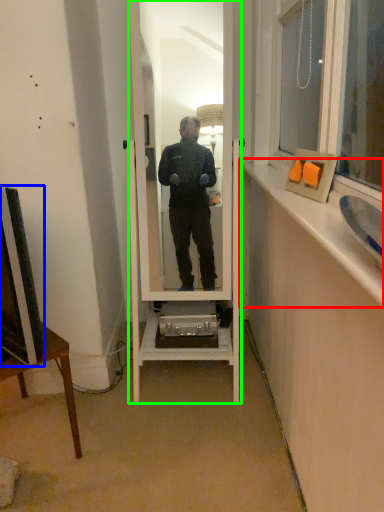
Question: Estimate the real-world distances between objects in this image. Which object is closer to window sill (highlighted by a red box), television (highlighted by a blue box) or mirror (highlighted by a green box)?

Choices:
 (A) television
 (B) mirror

Answer: (B)